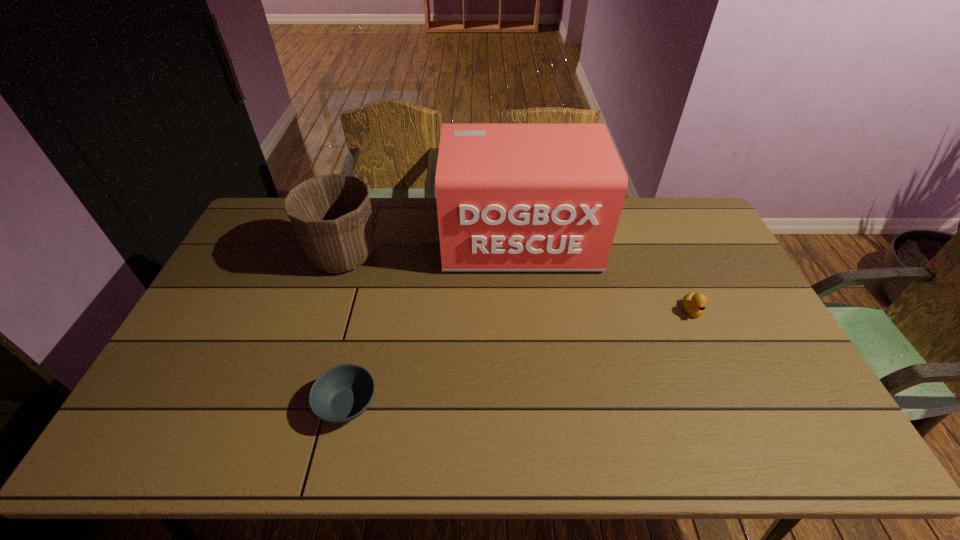
At what (x,y) coordinates should I click in order to perform the action: click on free location located 0.190m on the back of the soup bowl. Please return your answer as a coordinate pair (x, y). Looking at the image, I should click on (367, 321).

Where is `box located at the far edge`? The height and width of the screenshot is (540, 960). box located at the far edge is located at coordinates (510, 196).

The image size is (960, 540). What are the coordinates of `flowerpot that is at the far edge` in the screenshot? It's located at (331, 214).

You are a GUI agent. You are given a task and a screenshot of the screen. Output one action in this format:
    pyautogui.click(x=<x>, y=<y>)
    Task: Click on the object that is positioned at the near edge
    This screenshot has height=540, width=960.
    Given the screenshot: What is the action you would take?
    pyautogui.click(x=341, y=394)

Identify the location of vacant area at the far edge. The width and height of the screenshot is (960, 540). (392, 235).

Identify the location of vacant area at the left edge of the desktop. The image size is (960, 540). (265, 246).

Find the location of a particular element. Image resolution: width=960 pixels, height=540 pixels. vacant space at the right edge of the desktop is located at coordinates (764, 387).

Locate an element on the screen. This screenshot has height=540, width=960. vacant space at the far left corner of the desktop is located at coordinates (283, 214).

You are a GUI agent. You are given a task and a screenshot of the screen. Output one action in this format:
    pyautogui.click(x=<x>, y=<y>)
    Task: Click on the vacant space at the near right corner of the desktop
    The width and height of the screenshot is (960, 540).
    Given the screenshot: What is the action you would take?
    pyautogui.click(x=797, y=429)

Image resolution: width=960 pixels, height=540 pixels. I want to click on unoccupied position between the third farthest object and the third object from left to right, so click(x=606, y=275).